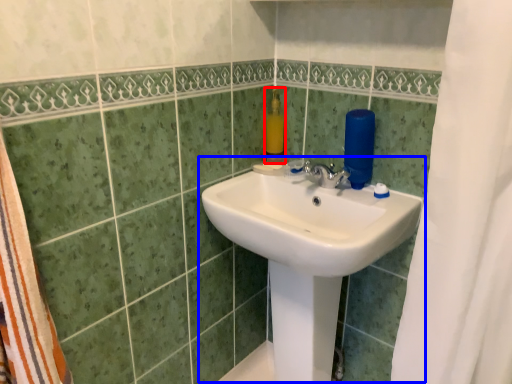
Question: Which object appears farthest to the camera in this image, soap dispenser (highlighted by a red box) or sink (highlighted by a blue box)?

Choices:
 (A) soap dispenser
 (B) sink

Answer: (A)